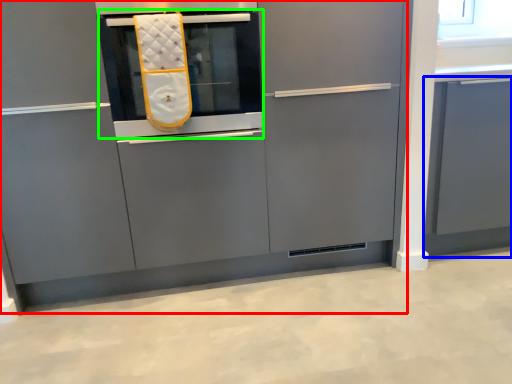
Question: Which object is positioned closest to cabinetry (highlighted by a red box)? Select from cabinetry (highlighted by a blue box) and oven (highlighted by a green box).

Choices:
 (A) cabinetry
 (B) oven

Answer: (B)